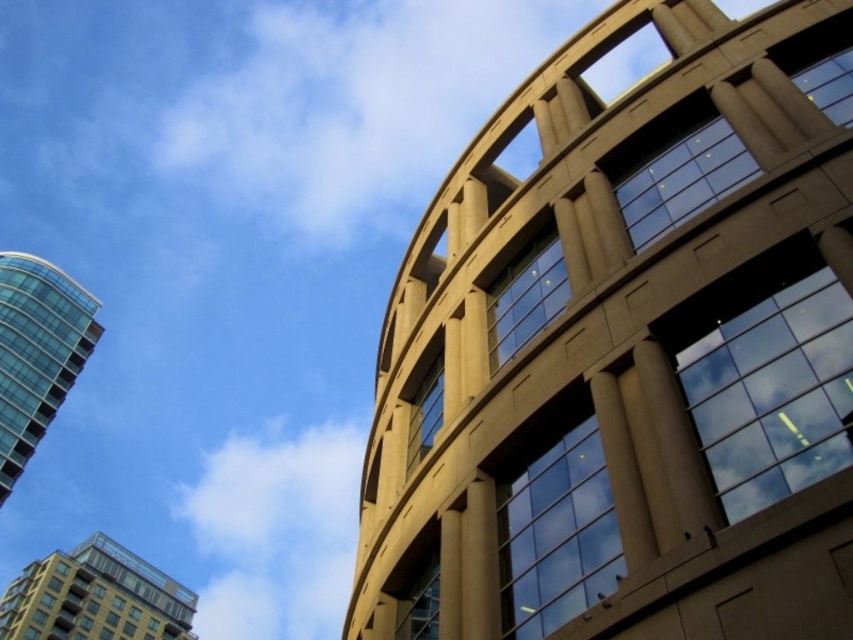
Question: Can you confirm if beige stone building at upper right is bigger than glassy reflective building at lower left?

Choices:
 (A) no
 (B) yes

Answer: (B)

Question: Which point appears closest to the camera in this image?

Choices:
 (A) (766, 417)
 (B) (36, 637)

Answer: (A)

Question: Which point is closer to the camera?

Choices:
 (A) beige stone building at upper right
 (B) glassy teal tower at left

Answer: (A)

Question: Is glassy teal tower at left positioned in front of glassy reflective building at lower left?

Choices:
 (A) yes
 (B) no

Answer: (A)

Question: Which point is farther to the camera?

Choices:
 (A) beige stone building at upper right
 (B) glassy teal tower at left
 (C) glassy reflective building at lower left

Answer: (C)

Question: Is beige stone building at upper right to the left of glassy teal tower at left from the viewer's perspective?

Choices:
 (A) yes
 (B) no

Answer: (B)